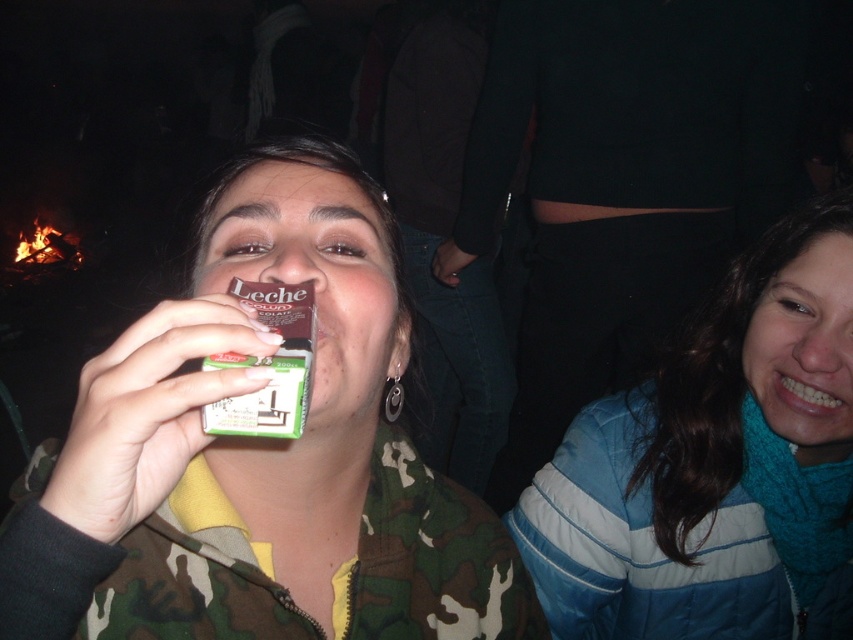
Between camouflage jacket at center and blue fleece jacket at lower right, which one has less height?

camouflage jacket at center is shorter.

Can you confirm if camouflage jacket at center is positioned below blue fleece jacket at lower right?

No, camouflage jacket at center is not below blue fleece jacket at lower right.

Where is `camouflage jacket at center`? Image resolution: width=853 pixels, height=640 pixels. camouflage jacket at center is located at coordinates (259, 456).